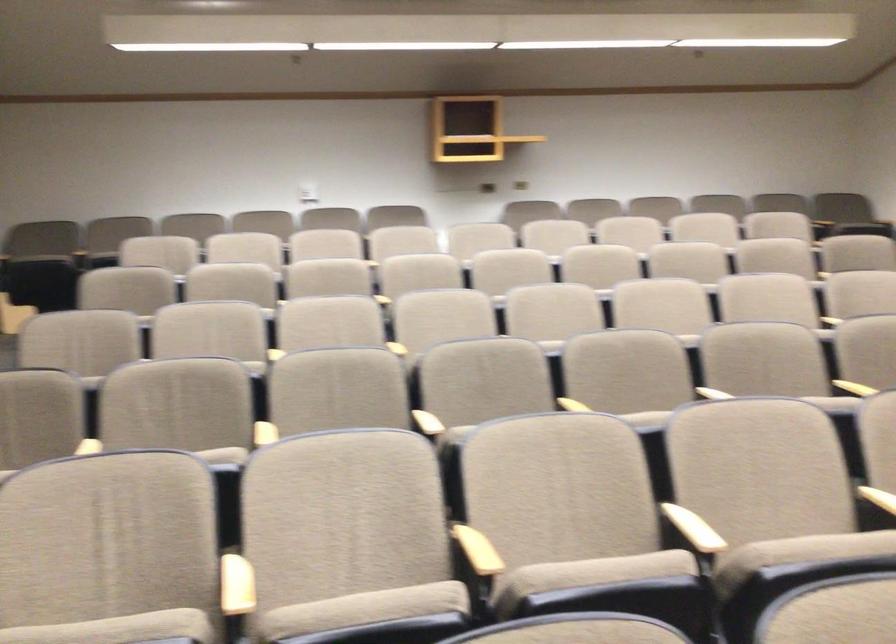
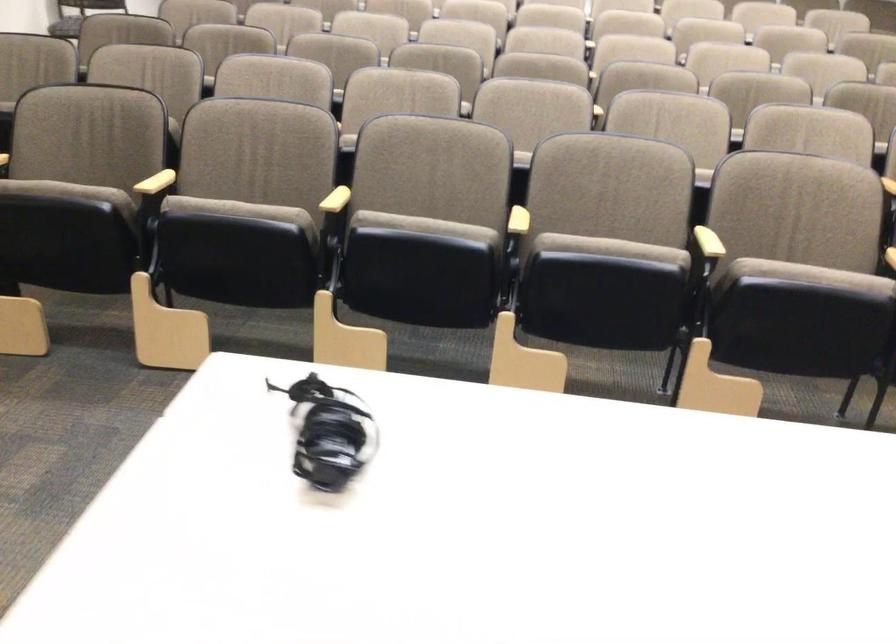
Question: I am providing you with two images of the same scene from different viewpoints. Which of the following objects are not visible in image2?

Choices:
 (A) black chair adjustment knob
 (B) beige chair sitting surface
 (C) chair sitting surface
 (D) wooden chair armrest

Answer: (B)